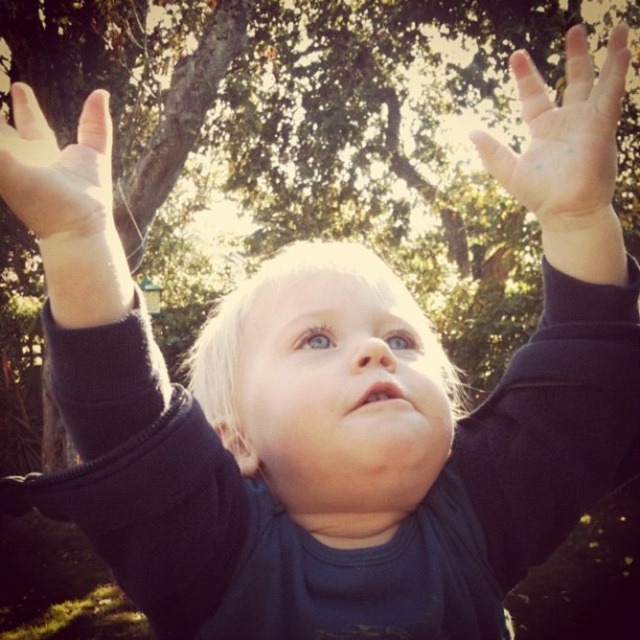
Question: Among these objects, which one is nearest to the camera?

Choices:
 (A) matte black arm at upper left
 (B) smooth skin palm at upper center

Answer: (A)

Question: Is smooth skin palm at upper center further to the viewer compared to smooth skin hand at upper left?

Choices:
 (A) yes
 (B) no

Answer: (A)

Question: Which object is farther from the camera taking this photo?

Choices:
 (A) smooth skin palm at upper center
 (B) matte black arm at upper left
 (C) smooth skin hand at upper left

Answer: (A)

Question: Which point appears farthest from the camera in this image?

Choices:
 (A) (106, 200)
 (B) (106, 115)
 (C) (580, 342)
 (D) (496, 140)

Answer: (C)

Question: Does dark blue fabric at upper center have a smaller size compared to smooth skin hand at upper left?

Choices:
 (A) yes
 (B) no

Answer: (A)

Question: Does dark blue fabric at upper center have a lesser width compared to smooth skin palm at upper center?

Choices:
 (A) no
 (B) yes

Answer: (B)